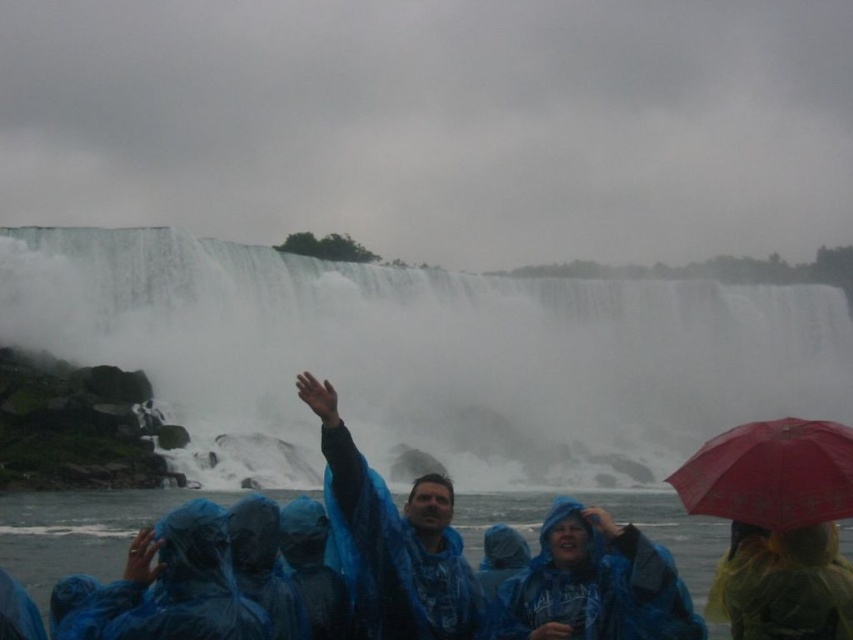
Is point (167, 538) positioned after point (830, 420)?

No, (167, 538) is closer to viewer.

Between point (230, 618) and point (819, 429), which one is positioned in front?

Positioned in front is point (230, 618).

The image size is (853, 640). In order to click on blue waterproof poncho at lower left in this screenshot , I will do `click(172, 586)`.

Can you confirm if blue waterproof jacket at lower center is positioned below yellow translucent raincoat at lower right?

Actually, blue waterproof jacket at lower center is above yellow translucent raincoat at lower right.

Between blue waterproof jacket at lower center and yellow translucent raincoat at lower right, which one appears on the left side from the viewer's perspective?

blue waterproof jacket at lower center

Identify the location of blue waterproof jacket at lower center. The width and height of the screenshot is (853, 640). (595, 584).

This screenshot has width=853, height=640. What are the coordinates of `blue waterproof jacket at lower center` in the screenshot? It's located at (595, 584).

Who is positioned more to the right, white misty waterfall at upper center or blue waterproof poncho at lower left?

Positioned to the right is white misty waterfall at upper center.

Find the location of a particular element. The width and height of the screenshot is (853, 640). white misty waterfall at upper center is located at coordinates (426, 356).

Where is `white misty waterfall at upper center`? This screenshot has height=640, width=853. white misty waterfall at upper center is located at coordinates (426, 356).